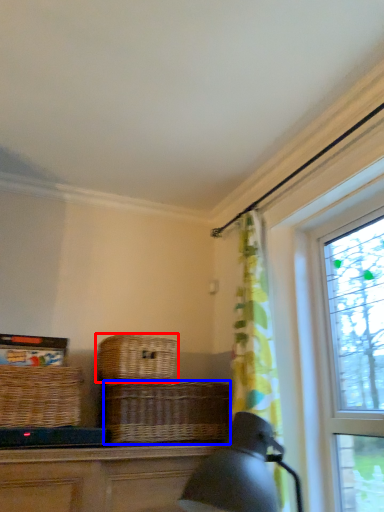
Question: Which object is closer to the camera taking this photo, picnic basket (highlighted by a red box) or basket (highlighted by a blue box)?

Choices:
 (A) picnic basket
 (B) basket

Answer: (B)